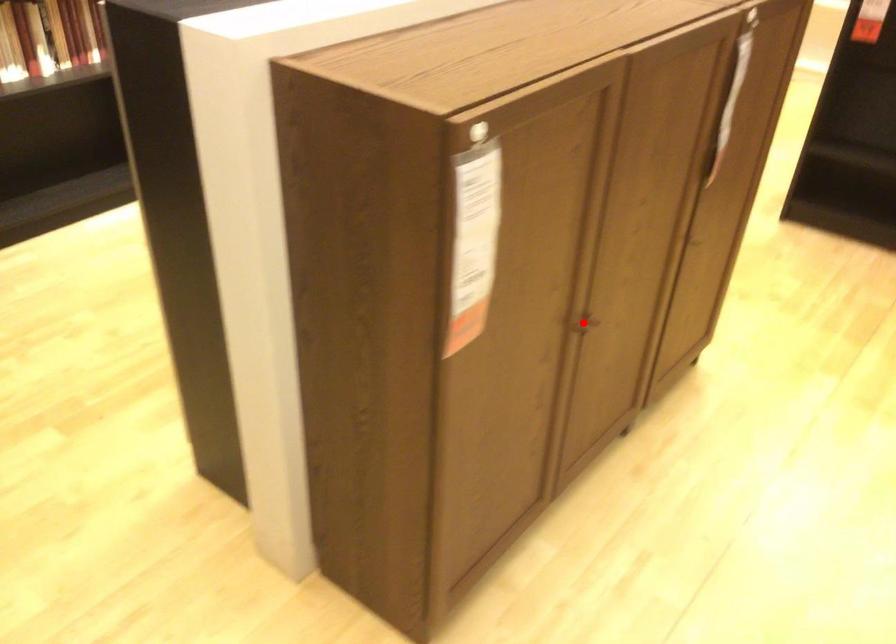
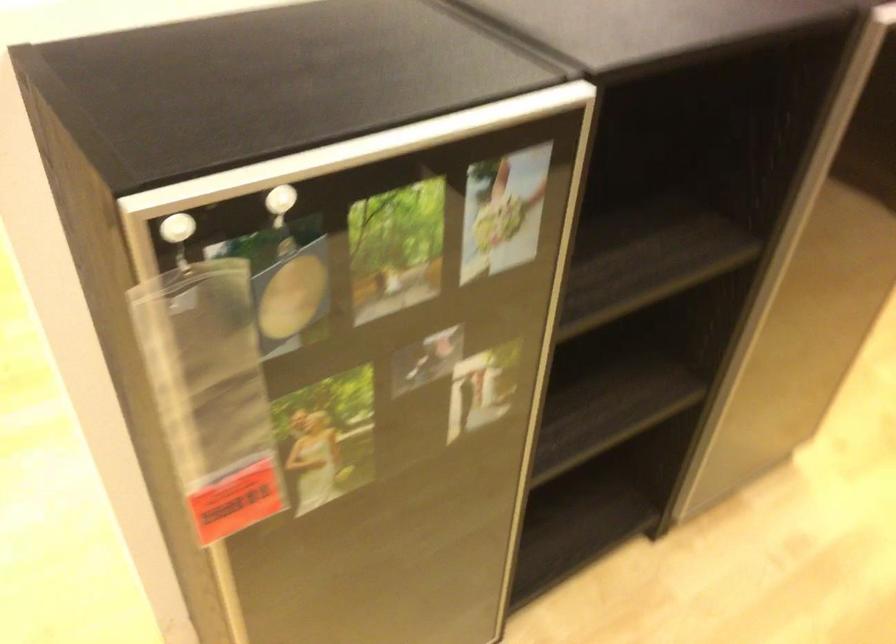
Question: I am providing you with two images of the same scene from different viewpoints. A red point is marked on the first image. Is the red point's position out of view in image 2?

Choices:
 (A) Yes
 (B) No

Answer: (A)